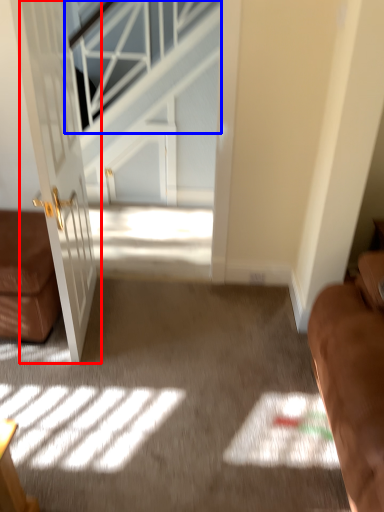
Question: Among these objects, which one is farthest to the camera, door (highlighted by a red box) or window (highlighted by a blue box)?

Choices:
 (A) door
 (B) window

Answer: (B)